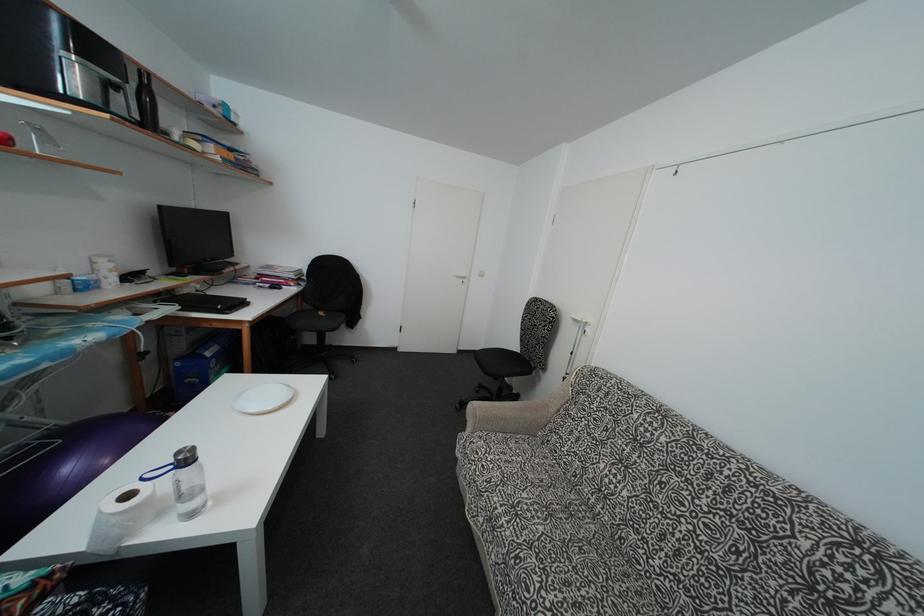
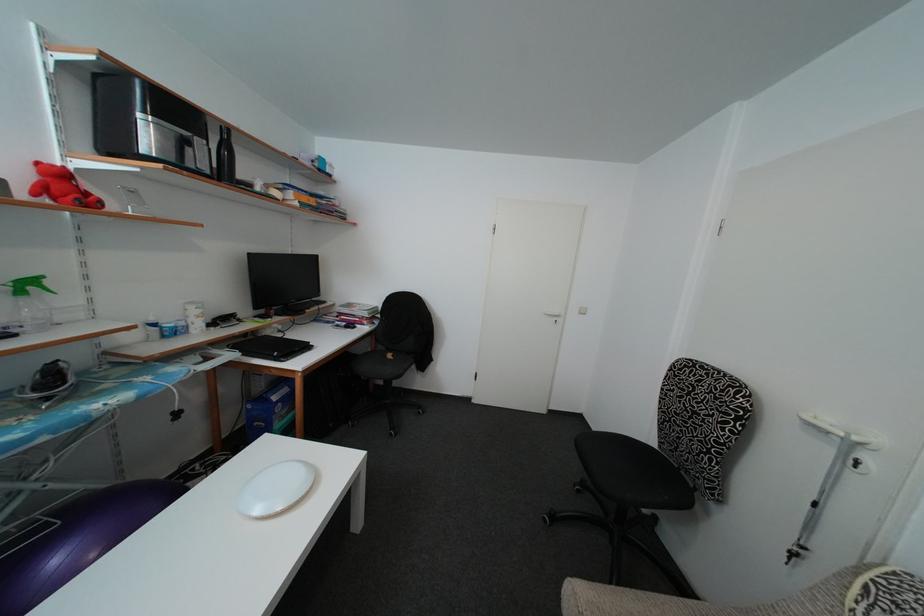
Question: The images are taken continuously from a first-person perspective. In which direction is your viewpoint rotating?

Choices:
 (A) Left
 (B) Right
 (C) Up
 (D) Down

Answer: (A)